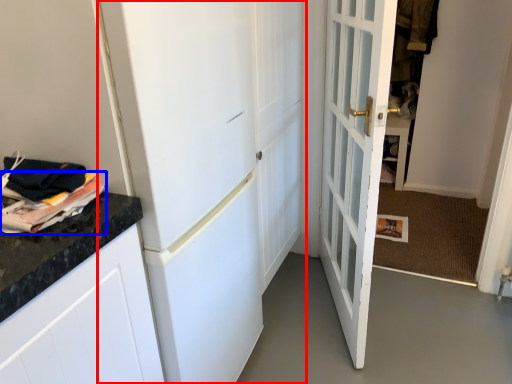
Question: Which object appears closest to the camera in this image, door (highlighted by a red box) or magazine (highlighted by a blue box)?

Choices:
 (A) door
 (B) magazine

Answer: (A)